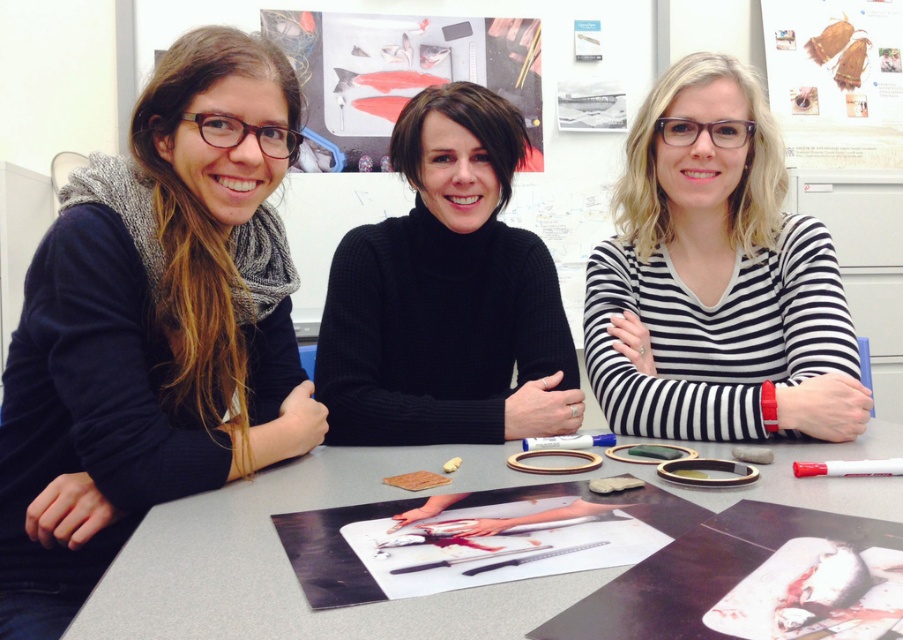
You are an observer sitting at the back of the room looking towards the table. Which of the two sweaters, the matte black sweater at left or the black turtleneck sweater at center, is positioned closer to the floor?

The matte black sweater at left is located below the black turtleneck sweater at center, so it is closer to the floor.